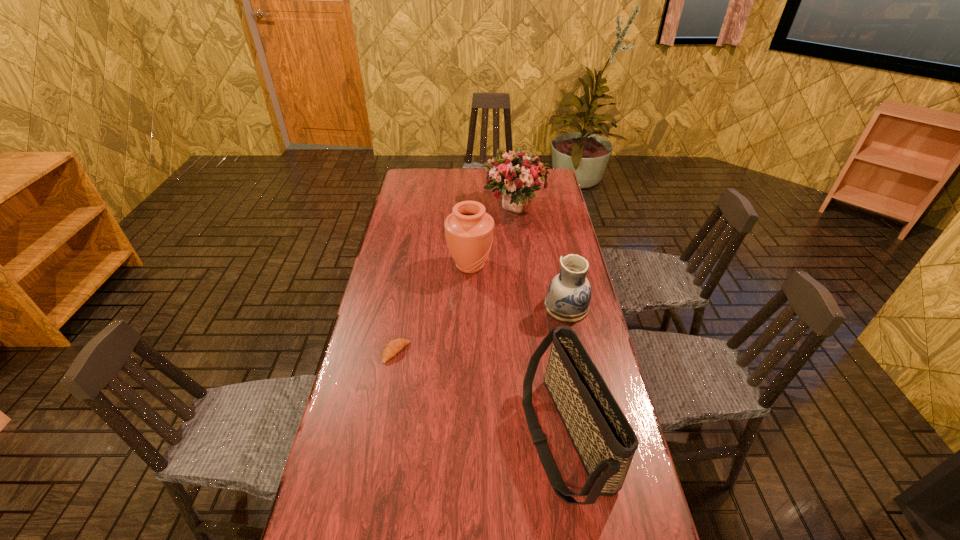
Image resolution: width=960 pixels, height=540 pixels. Find the location of `vacant area situated on the back of the shortest object`. vacant area situated on the back of the shortest object is located at coordinates (402, 315).

Where is `object at the far edge`? This screenshot has height=540, width=960. object at the far edge is located at coordinates (517, 175).

This screenshot has width=960, height=540. Find the location of `object situated at the left edge`. object situated at the left edge is located at coordinates pos(393,347).

Locate an element on the screen. Image resolution: width=960 pixels, height=540 pixels. bouquet that is positioned at the right edge is located at coordinates (517, 175).

Identify the location of handbag situated at the right edge. This screenshot has width=960, height=540. (604, 440).

Identify the location of pottery at the right edge. (569, 293).

This screenshot has height=540, width=960. Find the location of `object located in the far right corner section of the desktop`. object located in the far right corner section of the desktop is located at coordinates (517, 175).

The width and height of the screenshot is (960, 540). I want to click on vacant area at the far edge of the desktop, so click(x=464, y=192).

What are the coordinates of `free space at the left edge of the desktop` in the screenshot? It's located at (391, 361).

At what (x,y) coordinates should I click in order to perform the action: click on free spot at the right edge of the desktop. Please return your answer as a coordinate pair (x, y). Looking at the image, I should click on (560, 240).